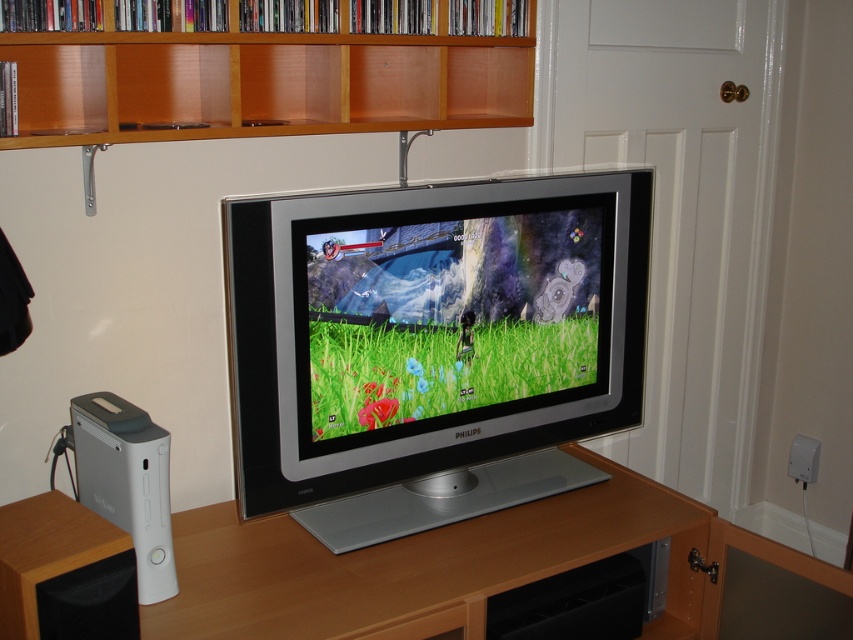
You are standing in the living room and want to know which of the two points, point (401, 44) or point (57, 566), is closer to you. Based on the scene description, can you determine which one is nearer?

Point (401, 44) is further to the camera than point (57, 566), so point (57, 566) is closer to you.

You are a delivery person who just arrived at the house to deliver a new gaming console. You need to place it on the same shelf as the brown wood speaker at lower left. The new console is the same size as the silver metallic television at center. Will it fit on the shelf?

The silver metallic television at center is larger in size than brown wood speaker at lower left. Since the new console is the same size as the television, it may not fit on the shelf designed for the smaller speaker unless there is enough space. However, the description does not provide information about the shelf dimensions, so we cannot confirm if it will fit based on the given details.

You are setting up a new TV stand and need to place both the wooden at upper center and the brown wood speaker at lower left. Given their sizes, which object should be placed first to ensure stability?

The wooden at upper center should be placed first because it has a larger size compared to the brown wood speaker at lower left, ensuring stability by placing the larger item first.